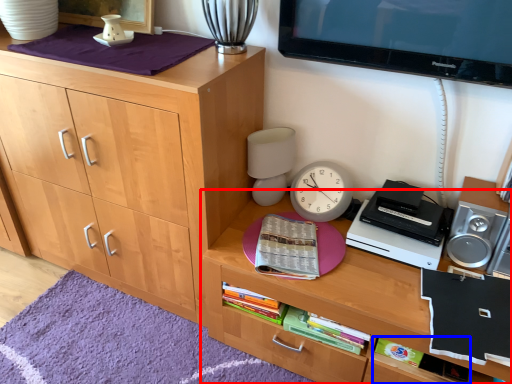
Question: Which object is closer to the camera taking this photo, desk (highlighted by a red box) or book (highlighted by a blue box)?

Choices:
 (A) desk
 (B) book

Answer: (A)